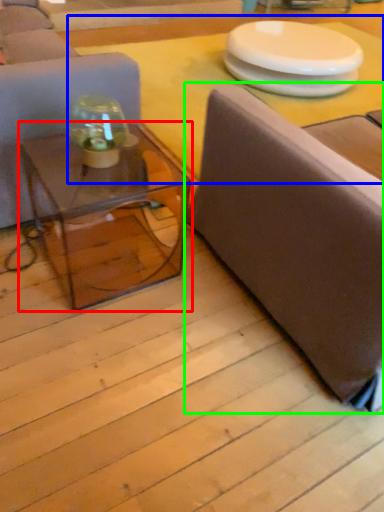
Question: Which object is positioned closest to coffee table (highlighted by a red box)? Select from table top (highlighted by a blue box) and studio couch (highlighted by a green box).

Choices:
 (A) table top
 (B) studio couch

Answer: (B)